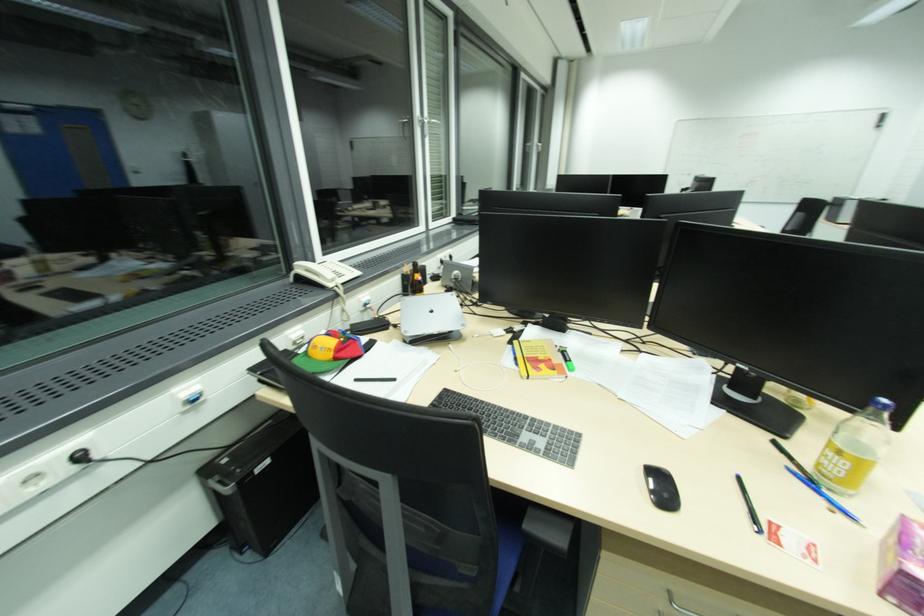
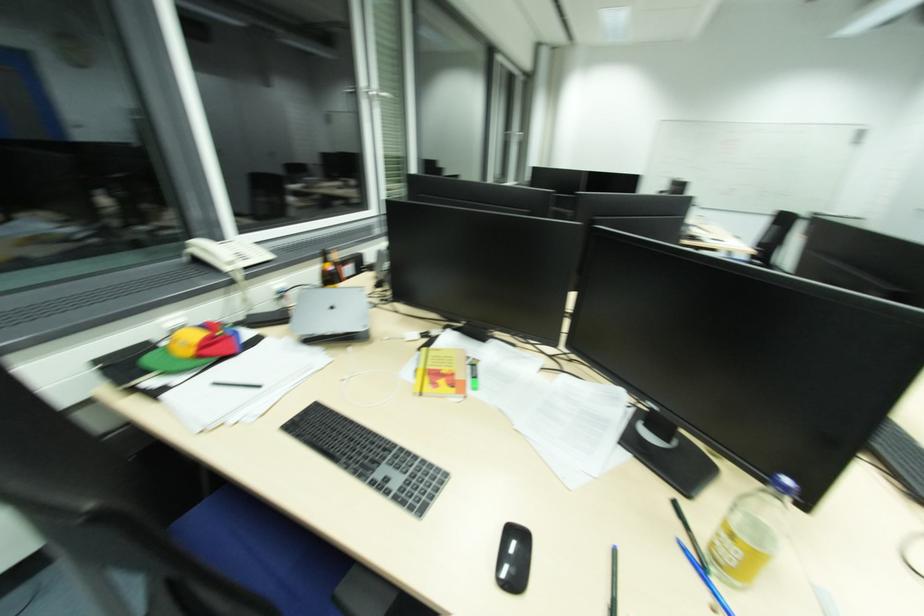
The point at (433, 313) is marked in the first image. Where is the corresponding point in the second image?

(335, 309)